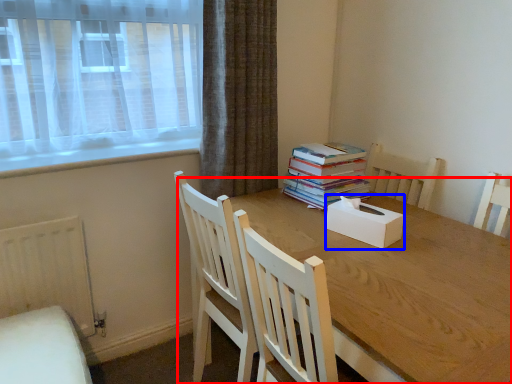
Question: Which point is further to the camera, round table (highlighted by a red box) or box (highlighted by a blue box)?

Choices:
 (A) round table
 (B) box

Answer: (B)